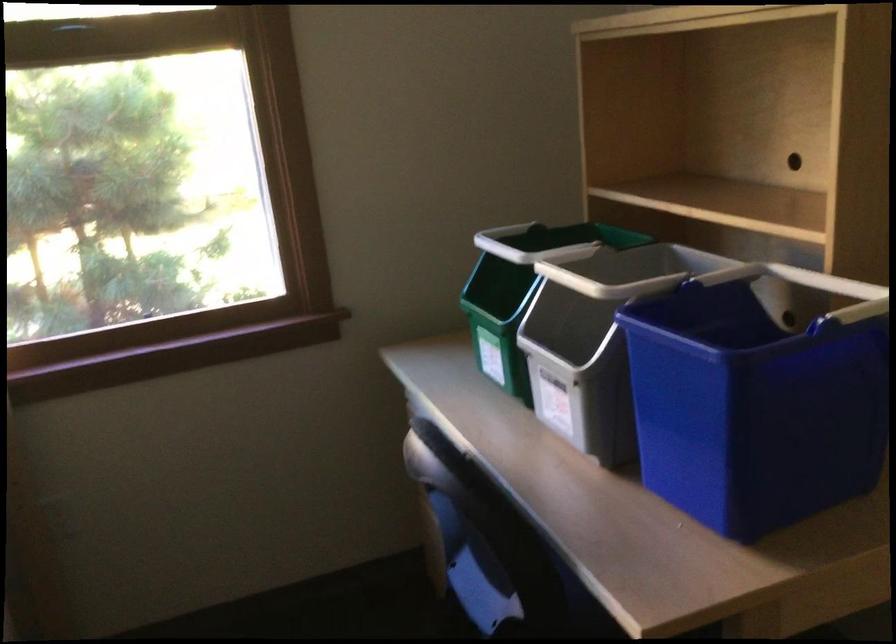
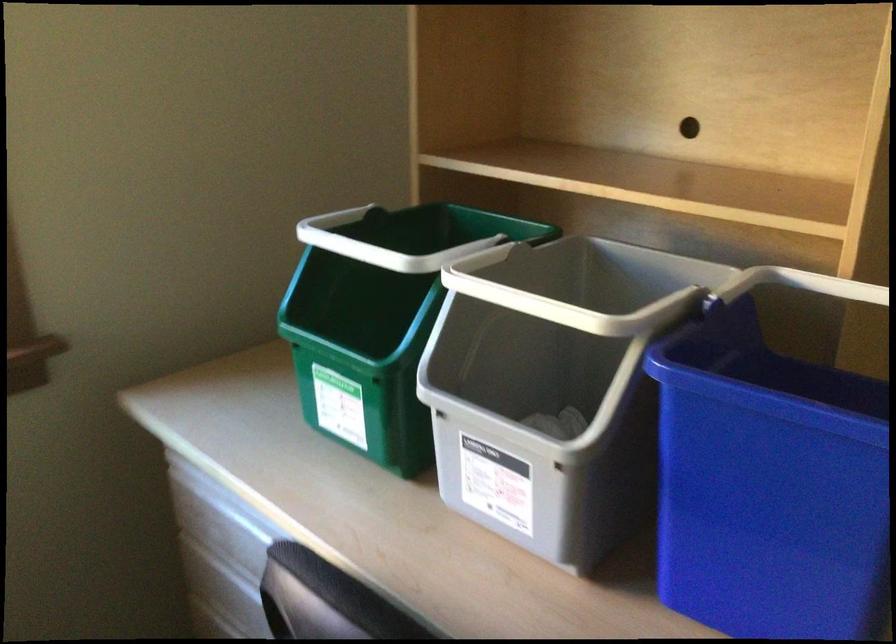
Question: The images are taken continuously from a first-person perspective. In which direction is your viewpoint rotating?

Choices:
 (A) Left
 (B) Right
 (C) Up
 (D) Down

Answer: (B)